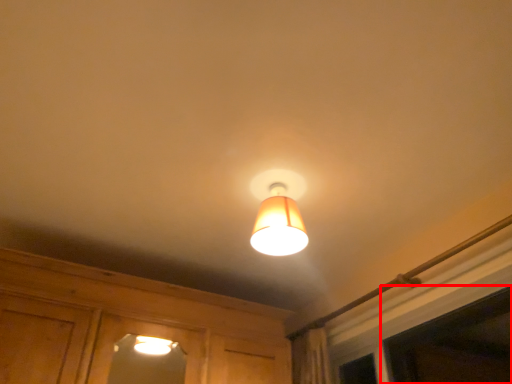
Question: From the image's perspective, where is window (annotated by the red box) located relative to lamp?

Choices:
 (A) above
 (B) below

Answer: (B)